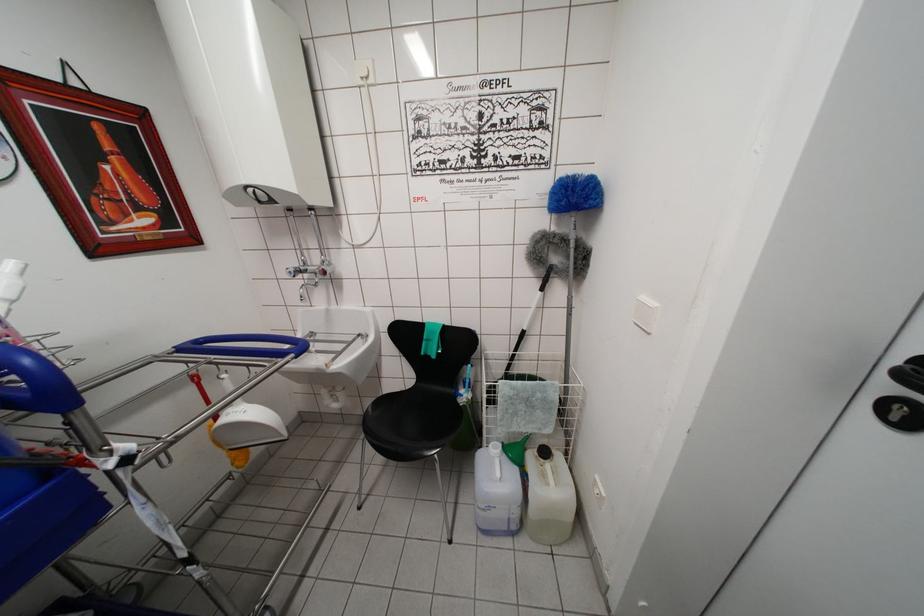
Find where to push the white light switch. Please return your answer as a coordinate pair (x, y).

(645, 313)